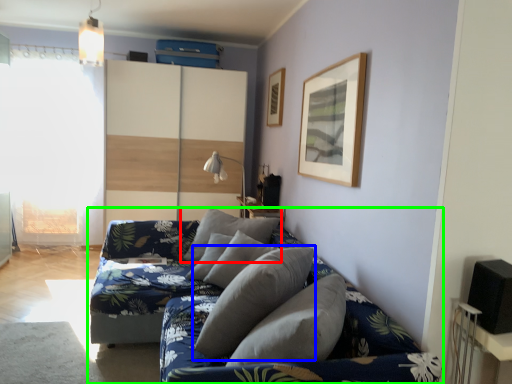
Question: Which object is positioned farthest from pillow (highlighted by a red box)? Select from pillow (highlighted by a blue box) and studio couch (highlighted by a green box).

Choices:
 (A) pillow
 (B) studio couch

Answer: (A)